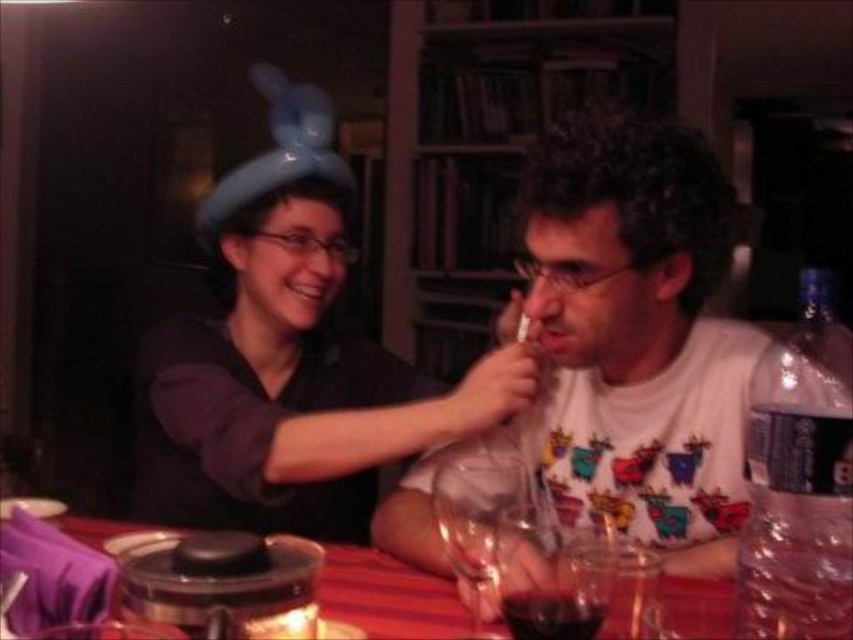
You are at a party and need to grab a drink quickly. The clear plastic bottle at right is above the red plastic table at center. Can you reach it without moving the table?

The clear plastic bottle at right is above the red plastic table at center, so it is likely within reach without needing to move the table since it is positioned above it.

You are at a party and need to decide which item to use to hold a drink. The clear plastic bottle at right and the red plastic table at center are available. Which one is more suitable for holding a drink?

The clear plastic bottle at right is more suitable for holding a drink because it is thinner than the red plastic table at center, making it easier to grip and use as a container.

You are a bartender who needs to pour a dark red liquid at glass center into a transparent glass wine at center. Can you pour it without spilling?

The transparent glass wine at center is above the dark red liquid at glass center, so you cannot pour the liquid upwards into the glass. You need to adjust their positions first.